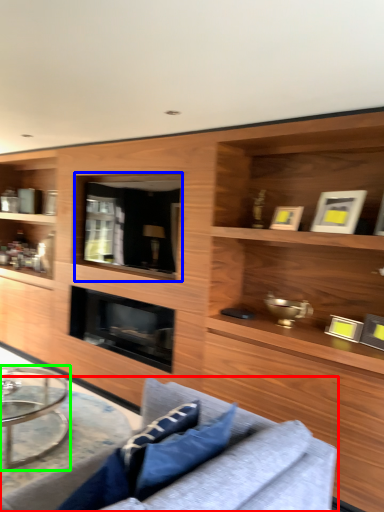
Question: Considering the real-world distances, which object is farthest from studio couch (highlighted by a red box)? glass door (highlighted by a blue box) or coffee table (highlighted by a green box)?

Choices:
 (A) glass door
 (B) coffee table

Answer: (A)